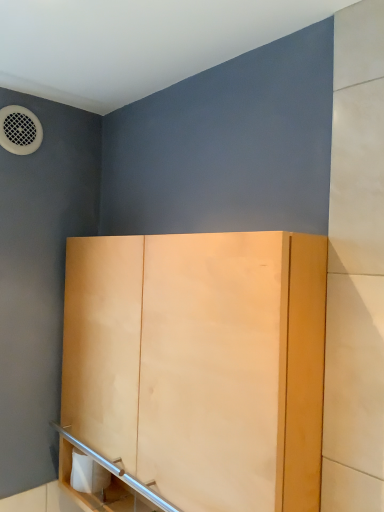
Question: In the image, is white matte toilet paper at lower left positioned in front of or behind light wood cabinet at center?

Choices:
 (A) behind
 (B) front

Answer: (A)

Question: Considering the positions of white matte toilet paper at lower left and light wood cabinet at center in the image, is white matte toilet paper at lower left taller or shorter than light wood cabinet at center?

Choices:
 (A) short
 (B) tall

Answer: (A)

Question: From the image's perspective, is white matte toilet paper at lower left above or below light wood cabinet at center?

Choices:
 (A) below
 (B) above

Answer: (A)

Question: Considering the positions of light wood cabinet at center and white matte toilet paper at lower left in the image, is light wood cabinet at center taller or shorter than white matte toilet paper at lower left?

Choices:
 (A) short
 (B) tall

Answer: (B)

Question: Is light wood cabinet at center inside the boundaries of white matte toilet paper at lower left, or outside?

Choices:
 (A) inside
 (B) outside

Answer: (B)

Question: Would you say light wood cabinet at center is to the left or to the right of white matte toilet paper at lower left in the picture?

Choices:
 (A) right
 (B) left

Answer: (A)

Question: Based on their sizes in the image, would you say light wood cabinet at center is bigger or smaller than white matte toilet paper at lower left?

Choices:
 (A) big
 (B) small

Answer: (A)